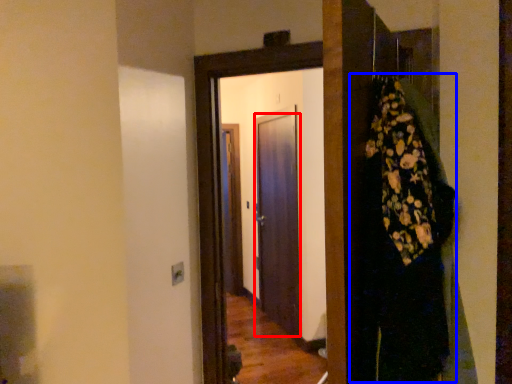
Question: Which point is closer to the camera, door (highlighted by a red box) or dress (highlighted by a blue box)?

Choices:
 (A) door
 (B) dress

Answer: (B)